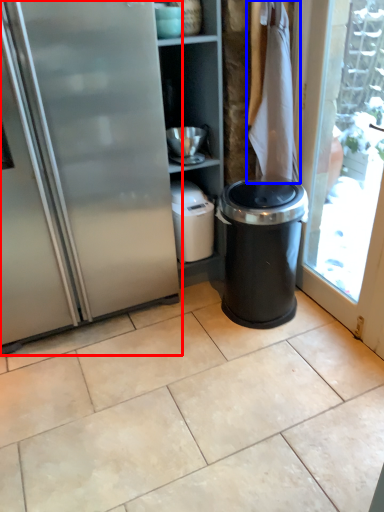
Question: Which of the following is the farthest to the observer, fridge (highlighted by a red box) or laundry (highlighted by a blue box)?

Choices:
 (A) fridge
 (B) laundry

Answer: (B)